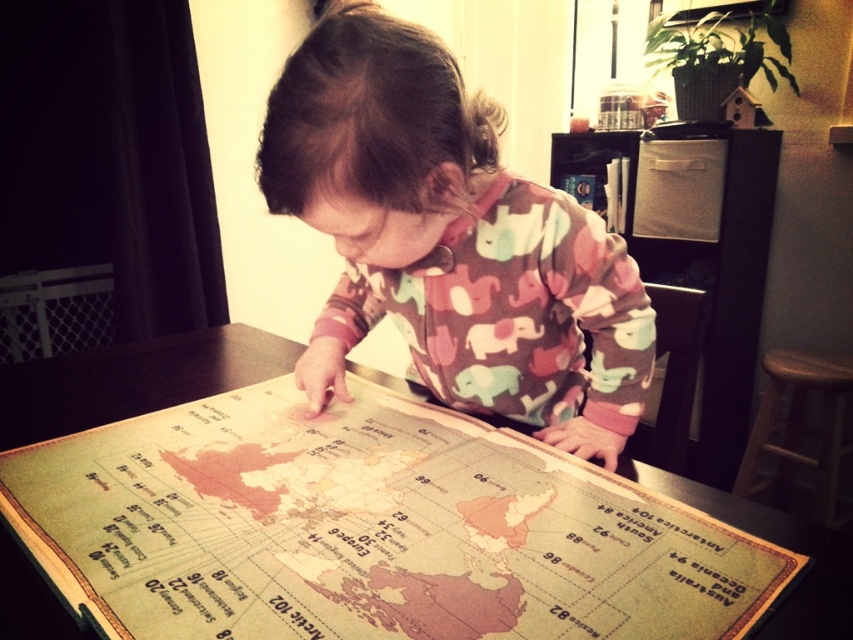
Question: Considering the real-world distances, which object is farthest from the brown wooden stool at lower right?

Choices:
 (A) vintage paper map at center
 (B) multicolored elephant pajamas at center

Answer: (A)

Question: Is multicolored elephant pajamas at center positioned in front of brown wooden stool at lower right?

Choices:
 (A) yes
 (B) no

Answer: (A)

Question: Among these objects, which one is farthest from the camera?

Choices:
 (A) brown wooden stool at lower right
 (B) multicolored elephant pajamas at center
 (C) vintage paper map at center

Answer: (A)

Question: Can you confirm if multicolored elephant pajamas at center is positioned above brown wooden stool at lower right?

Choices:
 (A) no
 (B) yes

Answer: (B)

Question: Does multicolored elephant pajamas at center have a larger size compared to brown wooden stool at lower right?

Choices:
 (A) yes
 (B) no

Answer: (A)

Question: Based on their relative distances, which object is nearer to the brown wooden stool at lower right?

Choices:
 (A) multicolored elephant pajamas at center
 (B) vintage paper map at center

Answer: (A)